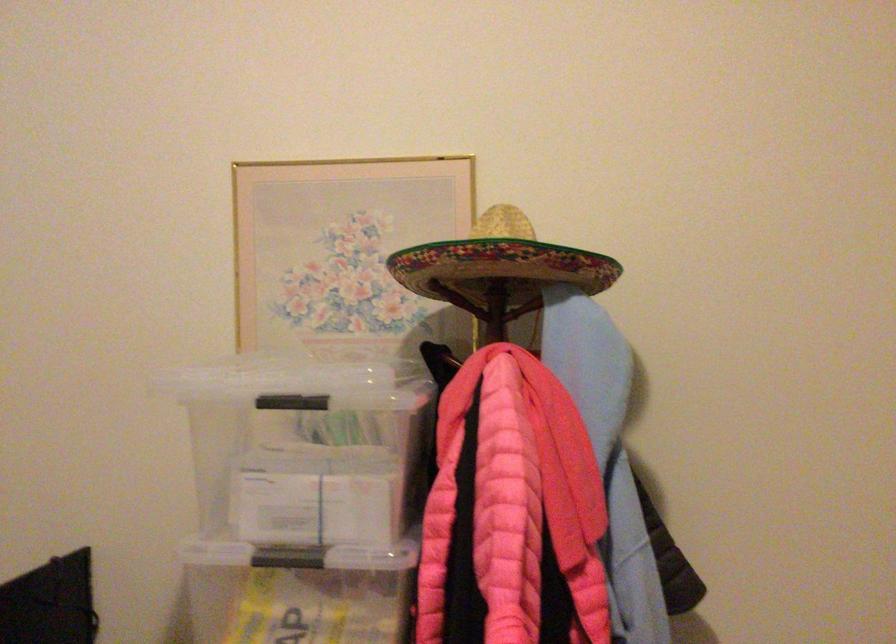
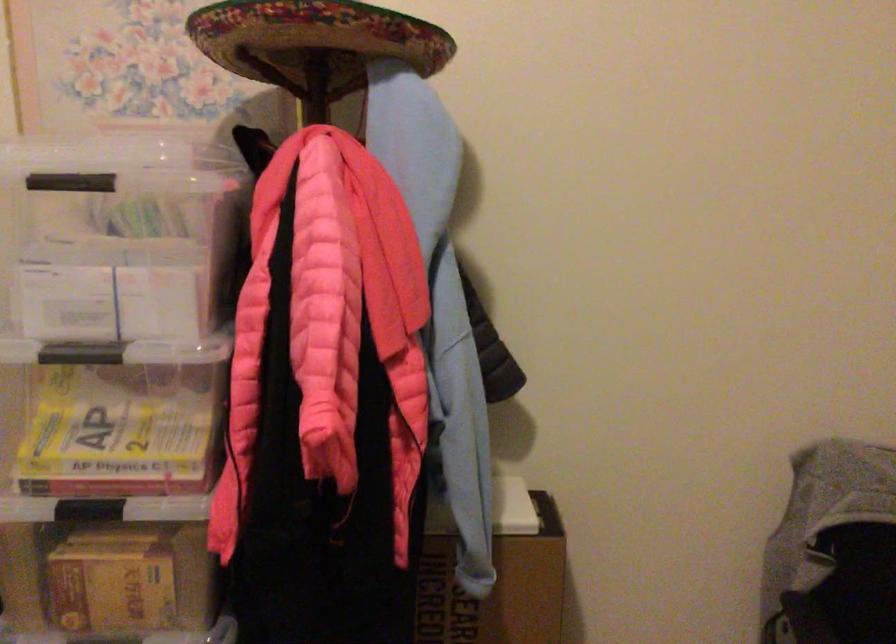
Where in the second image is the point corresponding to (498,272) from the first image?

(314, 40)